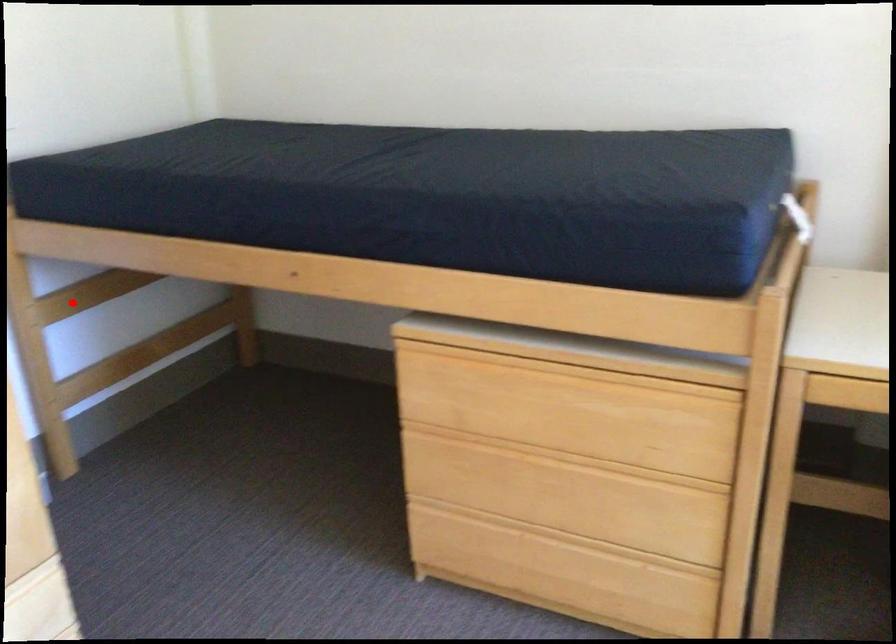
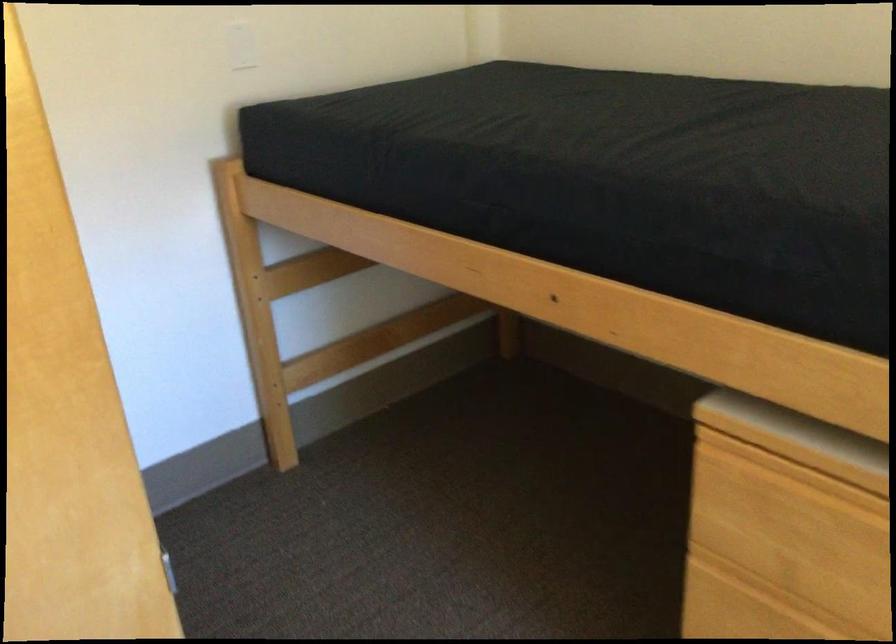
Where in the second image is the point corresponding to the highlighted location from the first image?

(307, 270)